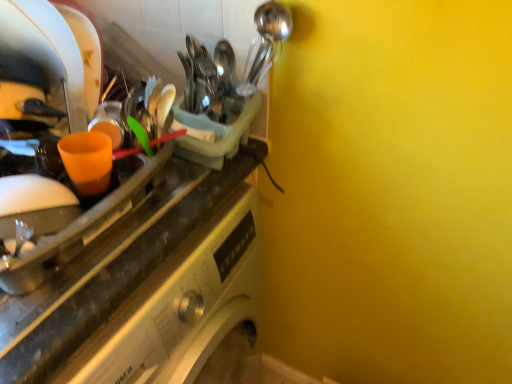
Question: Should I look upward or downward to see orange plastic cup at left?

Choices:
 (A) up
 (B) down

Answer: (B)